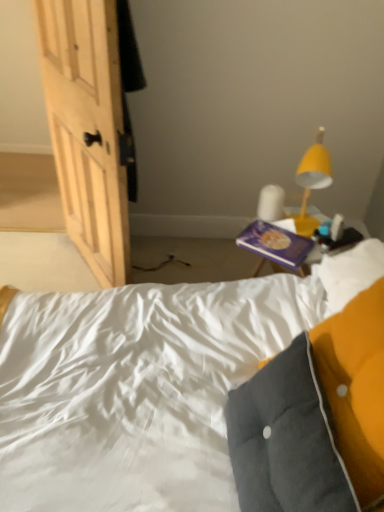
Question: Based on their positions, is purple matte book at upper right located to the left or right of yellow matte lamp at upper right?

Choices:
 (A) left
 (B) right

Answer: (A)

Question: Is purple matte book at upper right bigger or smaller than yellow matte lamp at upper right?

Choices:
 (A) small
 (B) big

Answer: (A)

Question: Which of these objects is positioned closest to the yellow matte lamp at upper right?

Choices:
 (A) purple matte book at upper right
 (B) velvety gray pillow at lower right

Answer: (A)

Question: Which object is positioned closest to the purple matte book at upper right?

Choices:
 (A) yellow matte lamp at upper right
 (B) velvety gray pillow at lower right

Answer: (A)